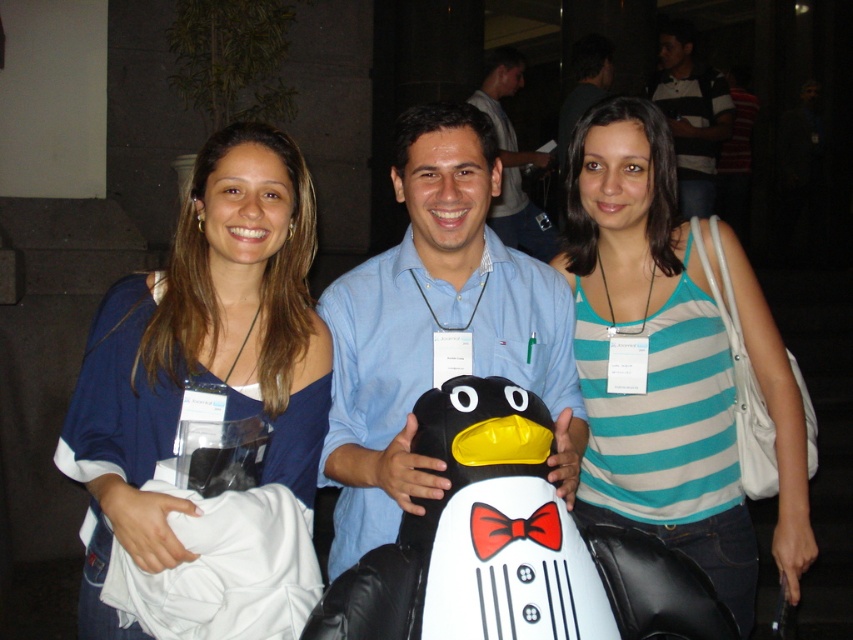
You are a photographer trying to capture a group photo of the blue fabric shirt at upper left and striped cotton shirt at upper right. You want to ensure both shirts are clearly visible in the frame. Given their widths, which shirt should you position closer to the camera to make them appear similar in size?

The blue fabric shirt at upper left has a lesser width compared to striped cotton shirt at upper right. To make them appear similar in size, position the blue fabric shirt at upper left closer to the camera since its actual width is smaller, requiring it to be nearer to compensate for the size difference.

You are standing in front of the group of three people in the image. You need to deliver a package to both the blue fabric shirt at center and the matte blue shirt at center. What is the minimum distance you need to walk to reach both of them?

The blue fabric shirt at center and the matte blue shirt at center are 3.58 meters apart from each other. To reach both, you would need to walk at least 3.58 meters.